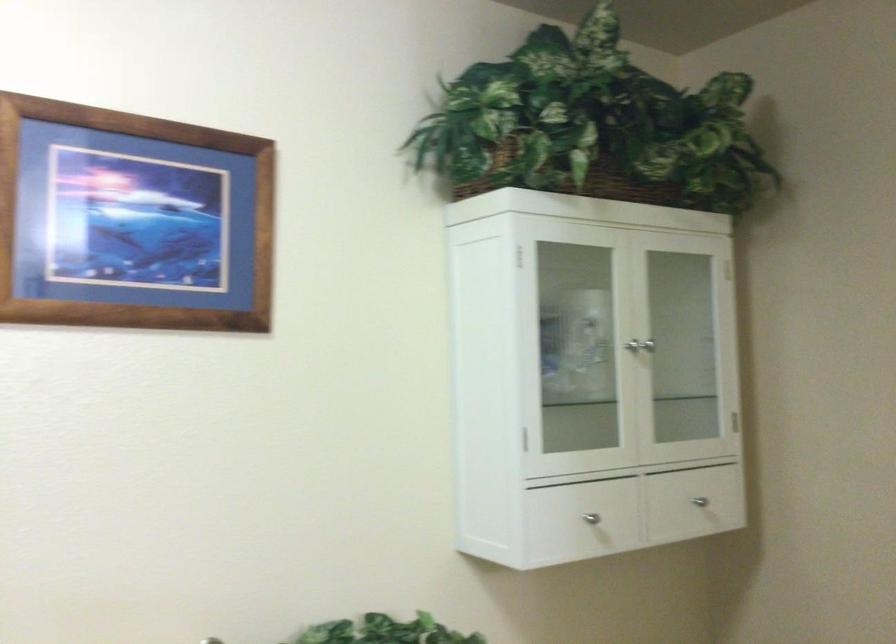
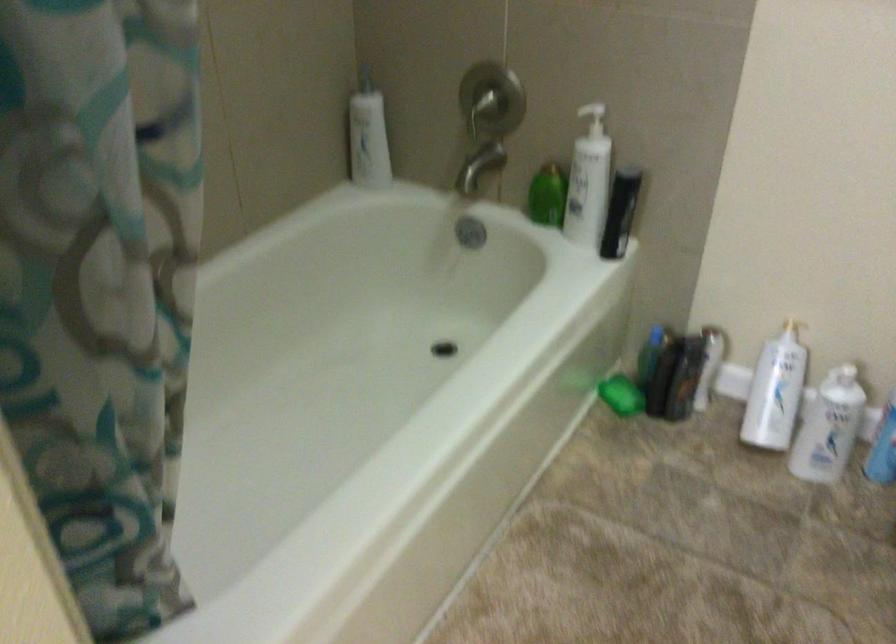
The first image is from the beginning of the video and the second image is from the end. How did the camera likely rotate when shooting the video?

The camera's rotation is toward left-down.